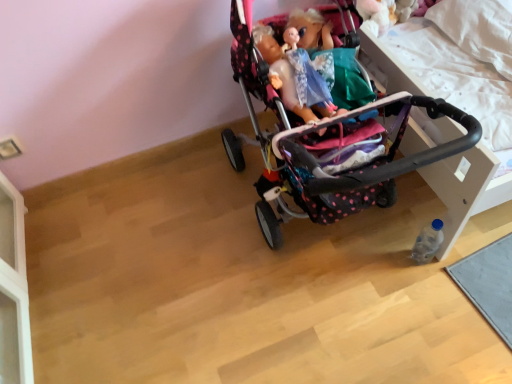
Describe the element at coordinates (315, 150) in the screenshot. This screenshot has width=512, height=384. I see `polka dot fabric stroller at center` at that location.

Measure the distance between polka dot fabric stroller at center and camera.

polka dot fabric stroller at center is 30.69 inches from camera.

The width and height of the screenshot is (512, 384). Find the location of `polka dot fabric stroller at center`. polka dot fabric stroller at center is located at coordinates (315, 150).

Image resolution: width=512 pixels, height=384 pixels. What do you see at coordinates (428, 242) in the screenshot?
I see `clear plastic bottle at lower right` at bounding box center [428, 242].

Measure the distance between point [437,226] and camera.

Point [437,226] is 1.27 meters away from camera.

Where is `clear plastic bottle at lower right`? clear plastic bottle at lower right is located at coordinates (428, 242).

Where is `polka dot fabric stroller at center`? This screenshot has width=512, height=384. polka dot fabric stroller at center is located at coordinates (315, 150).

Between polka dot fabric stroller at center and clear plastic bottle at lower right, which one appears on the right side from the viewer's perspective?

Positioned to the right is clear plastic bottle at lower right.

Between polka dot fabric stroller at center and clear plastic bottle at lower right, which one is positioned behind?

clear plastic bottle at lower right is more distant.

Which point is more forward, (240,157) or (437,230)?

The point (437,230) is closer.

From the image's perspective, is polka dot fabric stroller at center above clear plastic bottle at lower right?

Yes, from the image's perspective, polka dot fabric stroller at center is above clear plastic bottle at lower right.

From a real-world perspective, is polka dot fabric stroller at center physically above clear plastic bottle at lower right?

Yes, from a real-world perspective, polka dot fabric stroller at center is above clear plastic bottle at lower right.

Considering the sizes of objects polka dot fabric stroller at center and clear plastic bottle at lower right in the image provided, who is thinner, polka dot fabric stroller at center or clear plastic bottle at lower right?

clear plastic bottle at lower right is thinner.

Who is shorter, polka dot fabric stroller at center or clear plastic bottle at lower right?

clear plastic bottle at lower right is shorter.

Who is smaller, polka dot fabric stroller at center or clear plastic bottle at lower right?

Smaller between the two is clear plastic bottle at lower right.

Is polka dot fabric stroller at center completely or partially outside of clear plastic bottle at lower right?

That's correct, polka dot fabric stroller at center is outside of clear plastic bottle at lower right.

Is there a large distance between polka dot fabric stroller at center and clear plastic bottle at lower right?

That's not correct — polka dot fabric stroller at center is a little close to clear plastic bottle at lower right.

Could you tell me if polka dot fabric stroller at center is facing clear plastic bottle at lower right?

No.

What's the angular difference between polka dot fabric stroller at center and clear plastic bottle at lower right's facing directions?

polka dot fabric stroller at center and clear plastic bottle at lower right are facing 90.3 degrees away from each other.

Image resolution: width=512 pixels, height=384 pixels. I want to click on bottle that appears below the polka dot fabric stroller at center (from the image's perspective), so click(428, 242).

Considering the relative positions of clear plastic bottle at lower right and polka dot fabric stroller at center in the image provided, is clear plastic bottle at lower right to the right of polka dot fabric stroller at center from the viewer's perspective?

Yes, clear plastic bottle at lower right is to the right of polka dot fabric stroller at center.

Is clear plastic bottle at lower right positioned before polka dot fabric stroller at center?

No, the depth of clear plastic bottle at lower right is greater than that of polka dot fabric stroller at center.

Does point (440, 222) appear closer or farther from the camera than point (451, 115)?

Point (440, 222) is farther from the camera than point (451, 115).

From the image's perspective, relative to polka dot fabric stroller at center, is clear plastic bottle at lower right above or below?

Based on their image positions, clear plastic bottle at lower right is located beneath polka dot fabric stroller at center.

From a real-world perspective, is clear plastic bottle at lower right positioned under polka dot fabric stroller at center based on gravity?

Yes, from a real-world perspective, clear plastic bottle at lower right is beneath polka dot fabric stroller at center.

Considering the sizes of clear plastic bottle at lower right and polka dot fabric stroller at center in the image, is clear plastic bottle at lower right wider or thinner than polka dot fabric stroller at center?

Considering their sizes, clear plastic bottle at lower right looks slimmer than polka dot fabric stroller at center.

Looking at this image, can you confirm if clear plastic bottle at lower right is shorter than polka dot fabric stroller at center?

Indeed, clear plastic bottle at lower right has a lesser height compared to polka dot fabric stroller at center.

Between clear plastic bottle at lower right and polka dot fabric stroller at center, which one has smaller size?

clear plastic bottle at lower right is smaller.

Would you say clear plastic bottle at lower right contains polka dot fabric stroller at center?

Actually, polka dot fabric stroller at center is outside clear plastic bottle at lower right.

Is clear plastic bottle at lower right not close to polka dot fabric stroller at center?

clear plastic bottle at lower right is near polka dot fabric stroller at center, not far away.

Is clear plastic bottle at lower right facing towards polka dot fabric stroller at center?

Yes, clear plastic bottle at lower right is aimed at polka dot fabric stroller at center.

What's the angular difference between clear plastic bottle at lower right and polka dot fabric stroller at center's facing directions?

The facing directions of clear plastic bottle at lower right and polka dot fabric stroller at center are 90.3 degrees apart.

Where is `bottle that appears below the polka dot fabric stroller at center (from the image's perspective)`? The width and height of the screenshot is (512, 384). bottle that appears below the polka dot fabric stroller at center (from the image's perspective) is located at coordinates (428, 242).

Identify the location of bottle located on the right of polka dot fabric stroller at center. The width and height of the screenshot is (512, 384). (428, 242).

The image size is (512, 384). In the image, there is a clear plastic bottle at lower right. Find the location of `stroller above it (from the image's perspective)`. stroller above it (from the image's perspective) is located at coordinates (315, 150).